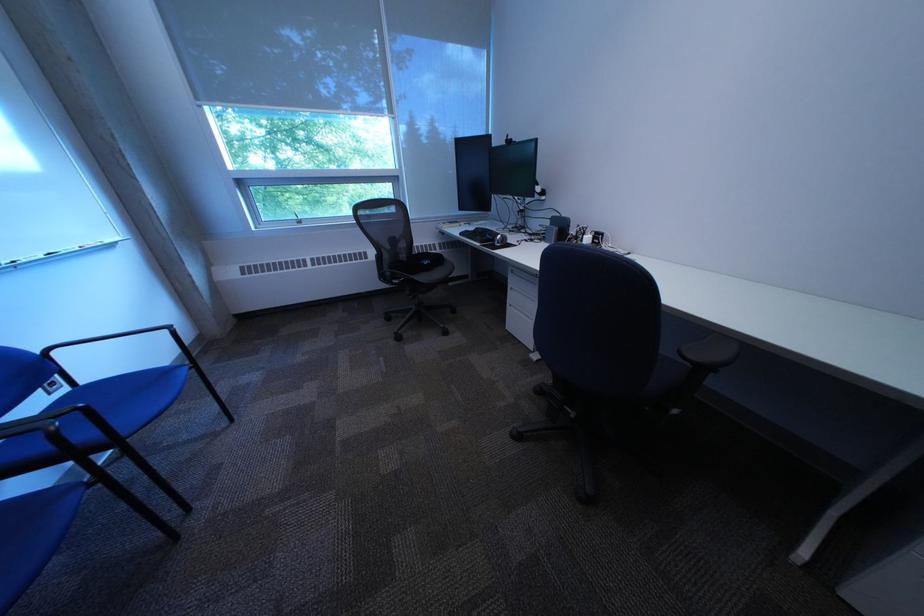
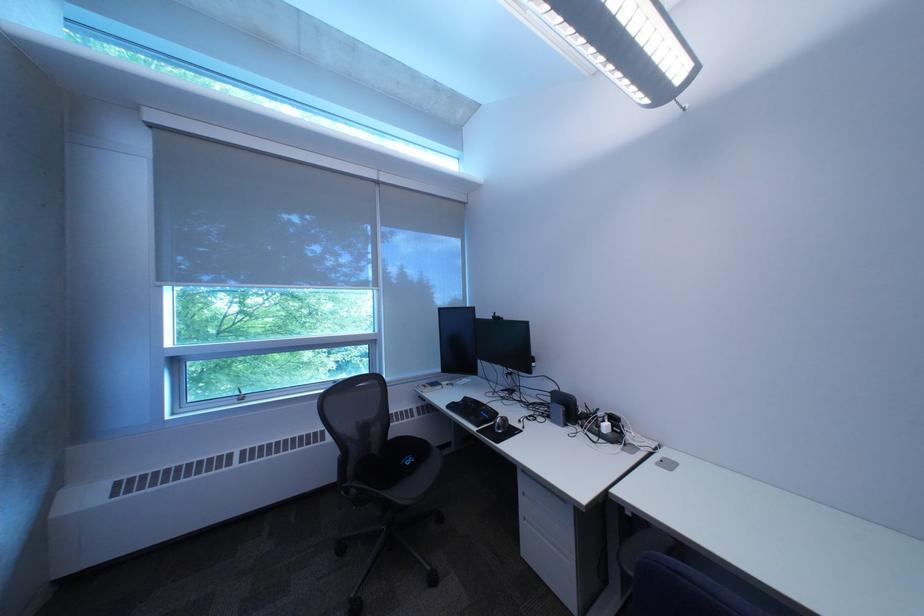
The point at (527,299) is marked in the first image. Where is the corresponding point in the second image?

(541, 506)